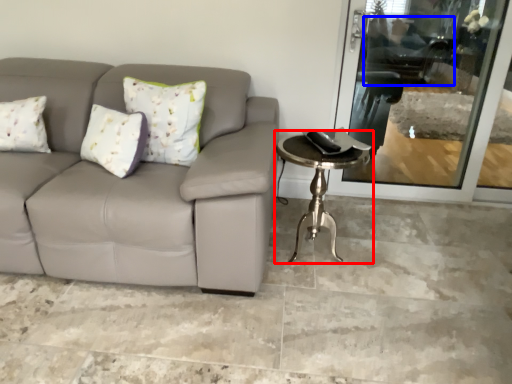
Question: Which object appears farthest to the camera in this image, table (highlighted by a red box) or swivel chair (highlighted by a blue box)?

Choices:
 (A) table
 (B) swivel chair

Answer: (B)